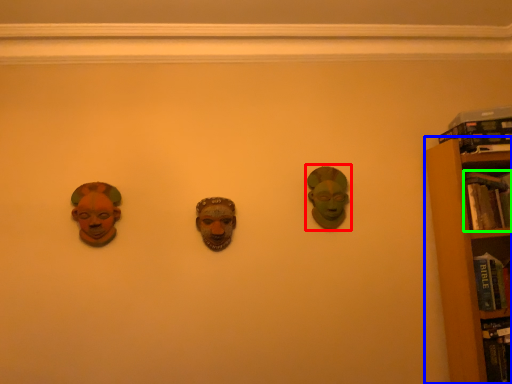
Question: Which is nearer to the head (highlighted by a red box)? bookcase (highlighted by a blue box) or book (highlighted by a green box).

Choices:
 (A) bookcase
 (B) book

Answer: (A)